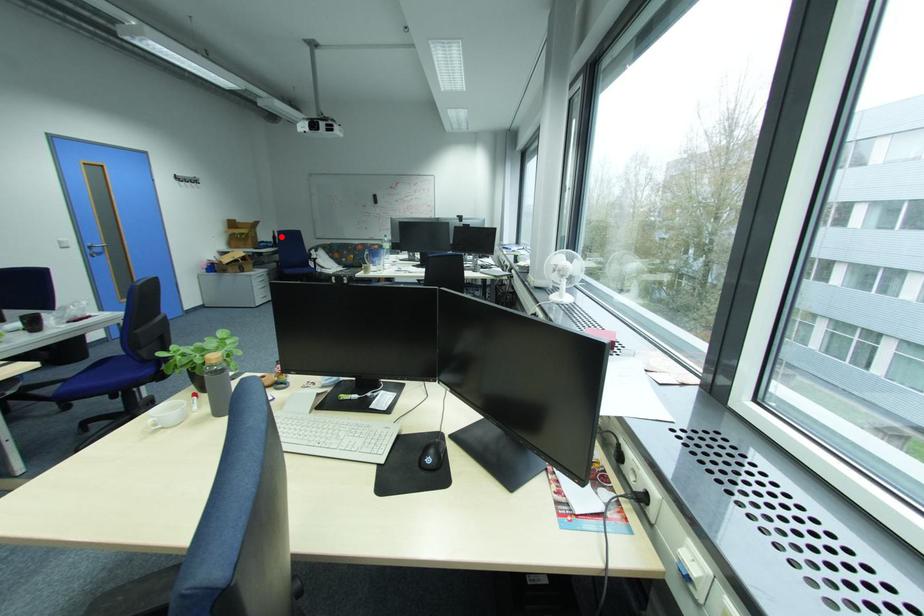
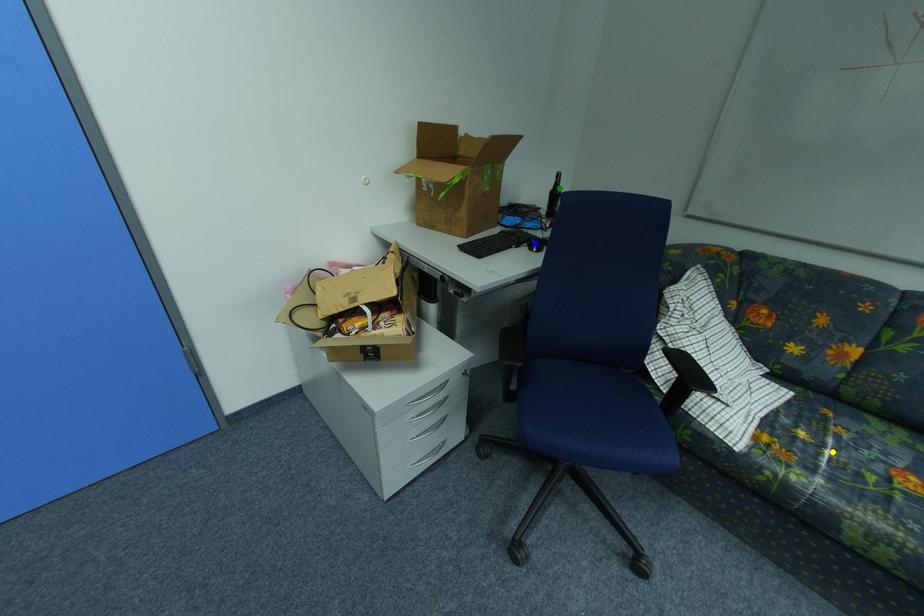
Question: I am providing you with two images of the same scene from different viewpoints. A red point is marked on the first image. You are given multiple points on the second image. Can you choose the point in image 2 that corresponds to the point in image 1?

Choices:
 (A) blue point
 (B) green point
 (C) yellow point

Answer: (B)